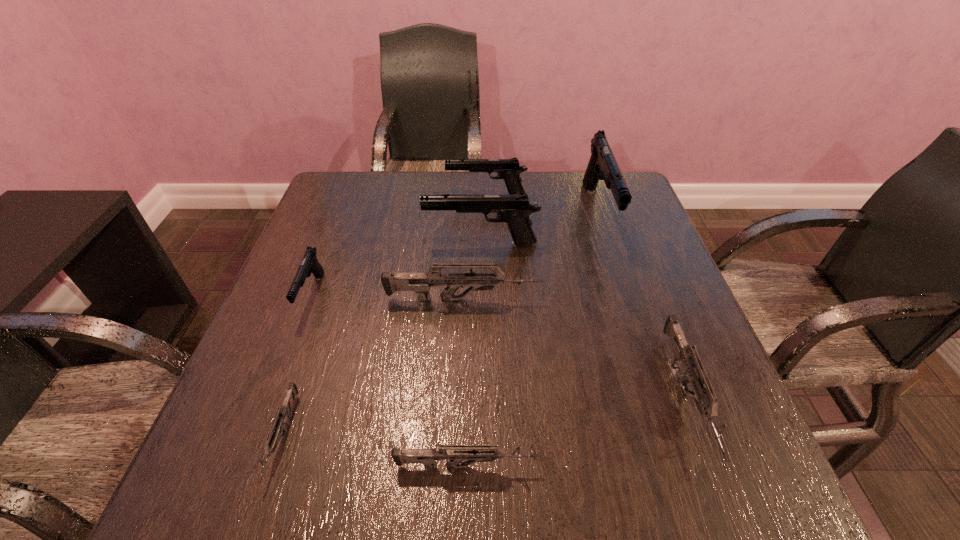
Locate which grey gun is the fourth closest to the seventh gun from left to right. Please provide its 2D coordinates. Your answer should be formatted as a tuple, i.e. [(x, y)], where the tuple contains the x and y coordinates of a point satisfying the conditions above.

[(273, 438)]

Identify which grey gun is located as the third nearest to the leftmost black gun. Please provide its 2D coordinates. Your answer should be formatted as a tuple, i.e. [(x, y)], where the tuple contains the x and y coordinates of a point satisfying the conditions above.

[(455, 454)]

In order to click on free space that satisfies the following two spatial constraints: 1. at the aiming end of the tallest object; 2. aimed along the barrel of the biggest grey gun in this screenshot , I will do `click(626, 299)`.

Find the location of a particular element. vacant space that satisfies the following two spatial constraints: 1. aimed along the barrel of the farthest grey gun; 2. aimed along the barrel of the shortest object is located at coordinates (457, 438).

Locate an element on the screen. The height and width of the screenshot is (540, 960). free space that satisfies the following two spatial constraints: 1. aimed along the barrel of the rightmost object; 2. aimed along the barrel of the seventh tallest gun is located at coordinates (713, 466).